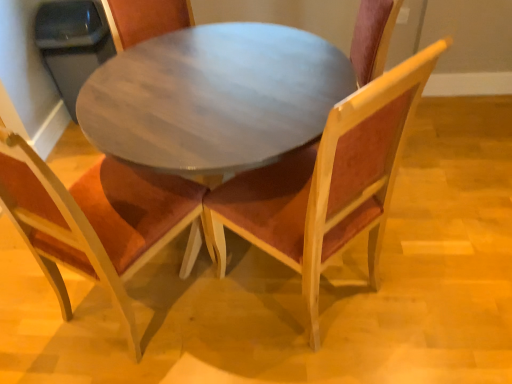
Image resolution: width=512 pixels, height=384 pixels. Describe the element at coordinates (326, 183) in the screenshot. I see `velvet burgundy chair at center, placed as the second chair when sorted from left to right` at that location.

Locate an element on the screen. The height and width of the screenshot is (384, 512). wooden chair with orange cushion at center, which ranks as the second chair in right-to-left order is located at coordinates (97, 220).

Is wooden round table at center situated inside wooden chair with orange cushion at center, which is the first chair from left to right, or outside?

wooden round table at center exists outside the volume of wooden chair with orange cushion at center, which is the first chair from left to right.

Is wooden round table at center shorter than wooden chair with orange cushion at center, which is the first chair from left to right?

Indeed, wooden round table at center has a lesser height compared to wooden chair with orange cushion at center, which is the first chair from left to right.

Who is bigger, wooden round table at center or wooden chair with orange cushion at center, which ranks as the second chair in right-to-left order?

wooden round table at center is bigger.

Is wooden round table at center wider or thinner than wooden chair with orange cushion at center, which ranks as the second chair in right-to-left order?

Clearly, wooden round table at center has more width compared to wooden chair with orange cushion at center, which ranks as the second chair in right-to-left order.

Which is correct: wooden round table at center is inside velvet burgundy chair at center, placed as the second chair when sorted from left to right, or outside of it?

wooden round table at center is outside velvet burgundy chair at center, placed as the second chair when sorted from left to right.

From the picture: Between wooden round table at center and velvet burgundy chair at center, placed as the second chair when sorted from left to right, which one has larger size?

wooden round table at center.

Is wooden round table at center wider or thinner than velvet burgundy chair at center, placed as the second chair when sorted from left to right?

Considering their sizes, wooden round table at center looks broader than velvet burgundy chair at center, placed as the second chair when sorted from left to right.

How far apart are wooden round table at center and velvet burgundy chair at center, arranged as the first chair when viewed from the right?

They are 13.51 inches apart.

What's the angular difference between velvet burgundy chair at center, arranged as the first chair when viewed from the right, and wooden chair with orange cushion at center, which is the first chair from left to right,'s facing directions?

The angle between the facing direction of velvet burgundy chair at center, arranged as the first chair when viewed from the right, and the facing direction of wooden chair with orange cushion at center, which is the first chair from left to right, is 72.6 degrees.

Is velvet burgundy chair at center, arranged as the first chair when viewed from the right, bigger than wooden chair with orange cushion at center, which ranks as the second chair in right-to-left order?

Indeed, velvet burgundy chair at center, arranged as the first chair when viewed from the right, has a larger size compared to wooden chair with orange cushion at center, which ranks as the second chair in right-to-left order.

From the image's perspective, which one is positioned higher, velvet burgundy chair at center, placed as the second chair when sorted from left to right, or wooden chair with orange cushion at center, which is the first chair from left to right?

velvet burgundy chair at center, placed as the second chair when sorted from left to right, is shown above in the image.

Does point (309, 301) come in front of point (69, 213)?

No, (309, 301) is behind (69, 213).

Considering the relative sizes of wooden chair with orange cushion at center, which is the first chair from left to right, and wooden round table at center in the image provided, is wooden chair with orange cushion at center, which is the first chair from left to right, thinner than wooden round table at center?

Indeed, wooden chair with orange cushion at center, which is the first chair from left to right, has a lesser width compared to wooden round table at center.

Is wooden chair with orange cushion at center, which ranks as the second chair in right-to-left order, far away from wooden round table at center?

Actually, wooden chair with orange cushion at center, which ranks as the second chair in right-to-left order, and wooden round table at center are a little close together.

From the picture: Considering the sizes of objects wooden chair with orange cushion at center, which ranks as the second chair in right-to-left order, and wooden round table at center in the image provided, who is bigger, wooden chair with orange cushion at center, which ranks as the second chair in right-to-left order, or wooden round table at center?

Bigger between the two is wooden round table at center.

Locate an element on the screen. This screenshot has height=384, width=512. coffee table on the right of wooden chair with orange cushion at center, which ranks as the second chair in right-to-left order is located at coordinates (214, 98).

Is velvet burgundy chair at center, placed as the second chair when sorted from left to right, at the back of wooden chair with orange cushion at center, which ranks as the second chair in right-to-left order?

No, wooden chair with orange cushion at center, which ranks as the second chair in right-to-left order, is not facing away from velvet burgundy chair at center, placed as the second chair when sorted from left to right.

I want to click on chair located behind the velvet burgundy chair at center, placed as the second chair when sorted from left to right, so click(97, 220).

Considering the points (132, 313) and (252, 195), which point is in front, point (132, 313) or point (252, 195)?

The point (252, 195) is more forward.

Based on their positions, is wooden chair with orange cushion at center, which ranks as the second chair in right-to-left order, located to the left or right of velvet burgundy chair at center, arranged as the first chair when viewed from the right?

Clearly, wooden chair with orange cushion at center, which ranks as the second chair in right-to-left order, is on the left of velvet burgundy chair at center, arranged as the first chair when viewed from the right, in the image.

Are velvet burgundy chair at center, placed as the second chair when sorted from left to right, and wooden round table at center beside each other?

velvet burgundy chair at center, placed as the second chair when sorted from left to right, is not next to wooden round table at center, and they're not touching.

Is velvet burgundy chair at center, arranged as the first chair when viewed from the right, turned away from wooden round table at center?

Yes, velvet burgundy chair at center, arranged as the first chair when viewed from the right, is facing away from wooden round table at center.

Is velvet burgundy chair at center, arranged as the first chair when viewed from the right, to the right of wooden round table at center from the viewer's perspective?

Correct, you'll find velvet burgundy chair at center, arranged as the first chair when viewed from the right, to the right of wooden round table at center.

Identify the location of coffee table above the velvet burgundy chair at center, placed as the second chair when sorted from left to right (from the image's perspective). The width and height of the screenshot is (512, 384). (214, 98).

Find the location of a particular element. The height and width of the screenshot is (384, 512). the 1st chair in front when counting from the wooden round table at center is located at coordinates (97, 220).

Identify the location of coffee table located above the velvet burgundy chair at center, placed as the second chair when sorted from left to right (from the image's perspective). The height and width of the screenshot is (384, 512). (214, 98).

From the image, which object appears to be farther from velvet burgundy chair at center, arranged as the first chair when viewed from the right, wooden round table at center or wooden chair with orange cushion at center, which is the first chair from left to right?

Based on the image, wooden chair with orange cushion at center, which is the first chair from left to right, appears to be further to velvet burgundy chair at center, arranged as the first chair when viewed from the right.

When comparing their distances from wooden round table at center, does velvet burgundy chair at center, placed as the second chair when sorted from left to right, or wooden chair with orange cushion at center, which is the first chair from left to right, seem further?

Based on the image, wooden chair with orange cushion at center, which is the first chair from left to right, appears to be further to wooden round table at center.

Considering their positions, is wooden round table at center positioned further to wooden chair with orange cushion at center, which is the first chair from left to right, than velvet burgundy chair at center, placed as the second chair when sorted from left to right?

Among the two, velvet burgundy chair at center, placed as the second chair when sorted from left to right, is located further to wooden chair with orange cushion at center, which is the first chair from left to right.

Looking at the image, which one is located closer to wooden chair with orange cushion at center, which ranks as the second chair in right-to-left order, velvet burgundy chair at center, placed as the second chair when sorted from left to right, or wooden round table at center?

wooden round table at center is closer to wooden chair with orange cushion at center, which ranks as the second chair in right-to-left order.

Based on their spatial positions, is wooden chair with orange cushion at center, which is the first chair from left to right, or velvet burgundy chair at center, placed as the second chair when sorted from left to right, further from wooden round table at center?

Among the two, wooden chair with orange cushion at center, which is the first chair from left to right, is located further to wooden round table at center.

From the image, which object appears to be farther from velvet burgundy chair at center, arranged as the first chair when viewed from the right, wooden chair with orange cushion at center, which ranks as the second chair in right-to-left order, or wooden round table at center?

Based on the image, wooden chair with orange cushion at center, which ranks as the second chair in right-to-left order, appears to be further to velvet burgundy chair at center, arranged as the first chair when viewed from the right.

The image size is (512, 384). In order to click on coffee table located between wooden chair with orange cushion at center, which ranks as the second chair in right-to-left order, and velvet burgundy chair at center, placed as the second chair when sorted from left to right, in the left-right direction in this screenshot , I will do `click(214, 98)`.